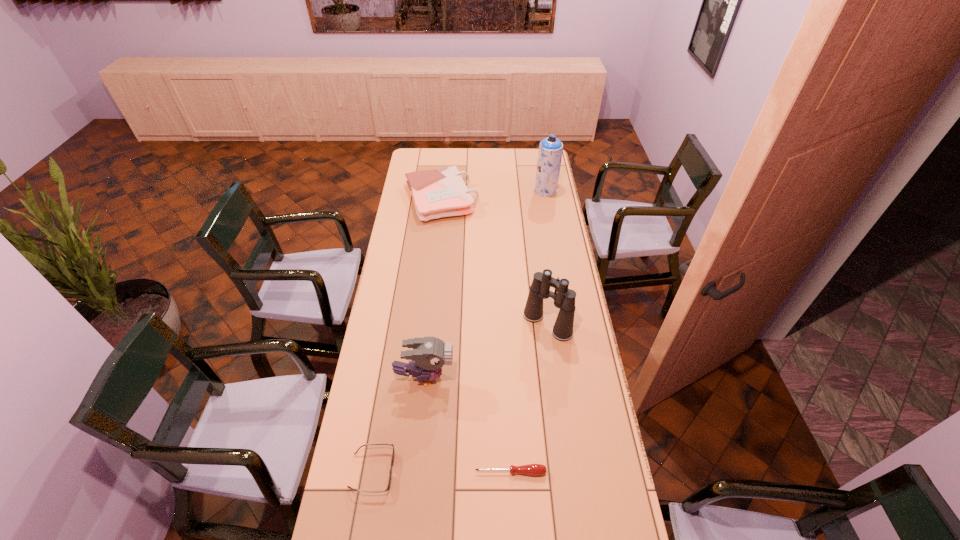
In order to click on free spot between the screwdriver and the phonebook in this screenshot , I will do pyautogui.click(x=476, y=335).

Where is `free space between the sunglasses and the third tallest object`? This screenshot has width=960, height=540. free space between the sunglasses and the third tallest object is located at coordinates (398, 424).

Locate an element on the screen. vacant space in between the third shortest object and the third farthest object is located at coordinates (494, 261).

This screenshot has width=960, height=540. I want to click on object that is the closest to the fourth tallest object, so click(550, 151).

Identify which object is located as the nearest to the third shortest object. Please provide its 2D coordinates. Your answer should be formatted as a tuple, i.e. [(x, y)], where the tuple contains the x and y coordinates of a point satisfying the conditions above.

[(550, 151)]

The height and width of the screenshot is (540, 960). Identify the location of free point that satisfies the following two spatial constraints: 1. on the back side of the third farthest object; 2. on the right side of the screwdriver. (504, 324).

Where is `free region that satisfies the following two spatial constraints: 1. on the front side of the fourth tallest object; 2. on the left side of the second tallest object`? Image resolution: width=960 pixels, height=540 pixels. free region that satisfies the following two spatial constraints: 1. on the front side of the fourth tallest object; 2. on the left side of the second tallest object is located at coordinates (428, 324).

Identify the location of free space that satisfies the following two spatial constraints: 1. on the back side of the screwdriver; 2. on the right side of the aerosol can. This screenshot has width=960, height=540. (497, 190).

Find the location of a particular element. free space that satisfies the following two spatial constraints: 1. on the back side of the aerosol can; 2. on the right side of the third shortest object is located at coordinates point(442,190).